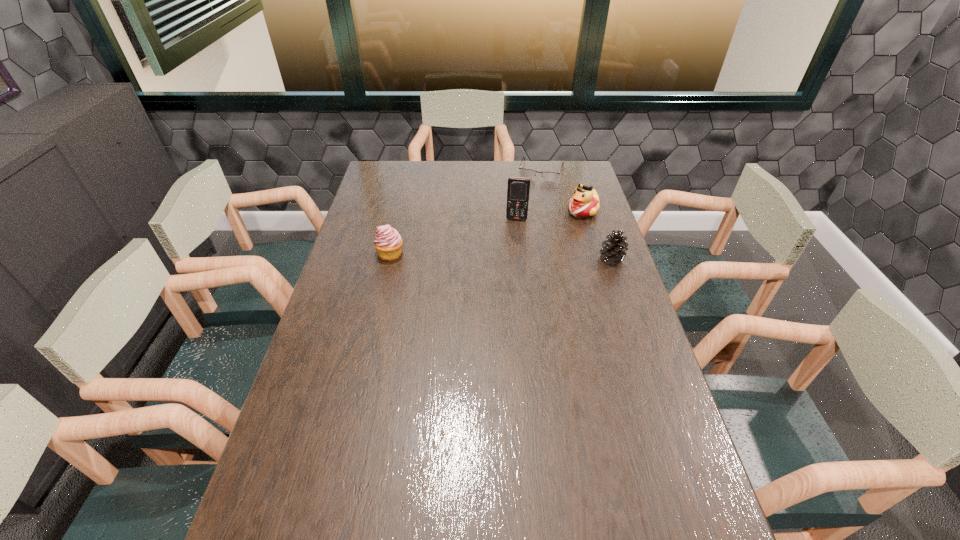
You are a GUI agent. You are given a task and a screenshot of the screen. Output one action in this format:
    pyautogui.click(x=<x>, y=<y>)
    Task: Click on the free space that satisfies the following two spatial constraints: 1. on the front side of the pinecone; 2. on the right side of the farthest object
    
    Given the screenshot: What is the action you would take?
    pyautogui.click(x=559, y=259)